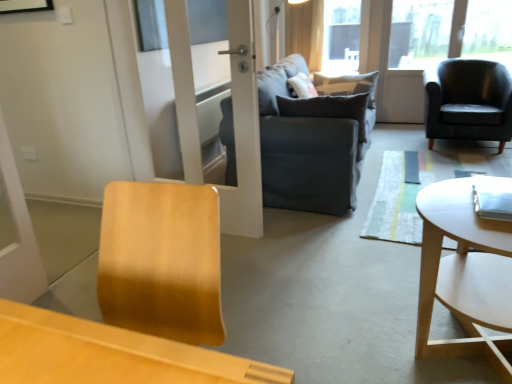
Image resolution: width=512 pixels, height=384 pixels. Identify the location of vacant space that is to the left of white wood coffee table at right. (336, 334).